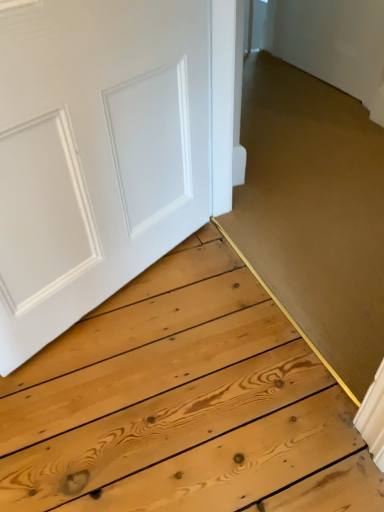
Describe the element at coordinates (314, 213) in the screenshot. I see `brown textured mat at lower right` at that location.

Measure the distance between brown textured mat at lower right and camera.

brown textured mat at lower right is 1.13 meters from camera.

At what (x,y) coordinates should I click in order to perform the action: click on brown textured mat at lower right. Please return your answer as a coordinate pair (x, y). This screenshot has width=384, height=512. Looking at the image, I should click on (314, 213).

Identify the location of brown textured mat at lower right. Image resolution: width=384 pixels, height=512 pixels. pyautogui.click(x=314, y=213).